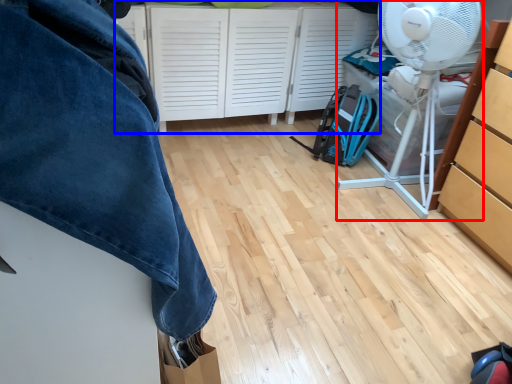
Question: Which object appears closest to the camera in this image, mechanical fan (highlighted by a red box) or cabinetry (highlighted by a blue box)?

Choices:
 (A) mechanical fan
 (B) cabinetry

Answer: (A)